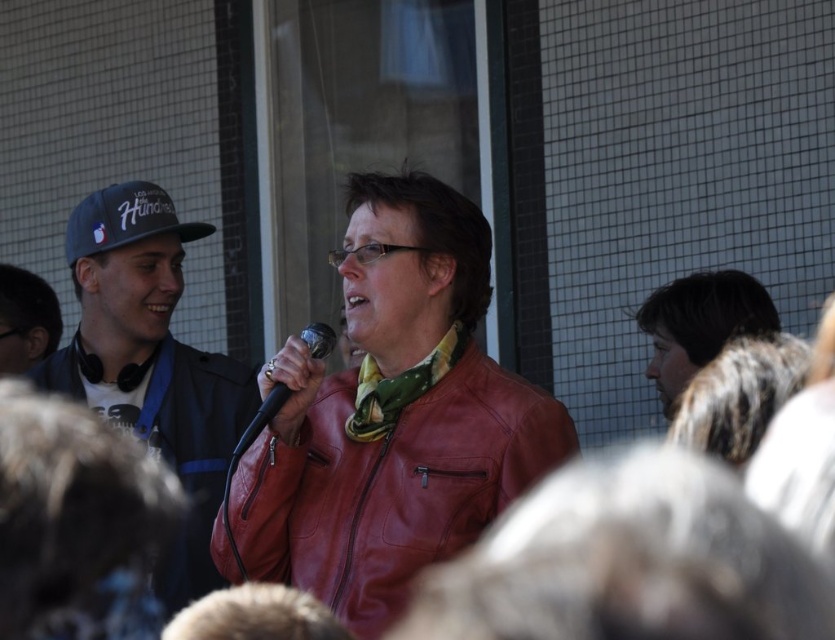
Question: Estimate the real-world distances between objects in this image. Which object is closer to the black metallic microphone at center?

Choices:
 (A) matte red leather jacket at center
 (B) blue fabric baseball cap at left
 (C) matte black cap at left

Answer: (A)

Question: Where is blue fabric baseball cap at left located in relation to black metallic microphone at center in the image?

Choices:
 (A) above
 (B) below

Answer: (A)

Question: Observing the image, what is the correct spatial positioning of blue fabric baseball cap at left in reference to black metallic microphone at center?

Choices:
 (A) above
 (B) below

Answer: (A)

Question: Which object is the farthest from the blue fabric baseball cap at left?

Choices:
 (A) matte black cap at left
 (B) matte red leather jacket at center

Answer: (B)

Question: Which is nearer to the matte red leather jacket at center?

Choices:
 (A) blue fabric baseball cap at left
 (B) matte black cap at left

Answer: (B)

Question: Is matte black cap at left thinner than blue fabric baseball cap at left?

Choices:
 (A) yes
 (B) no

Answer: (B)